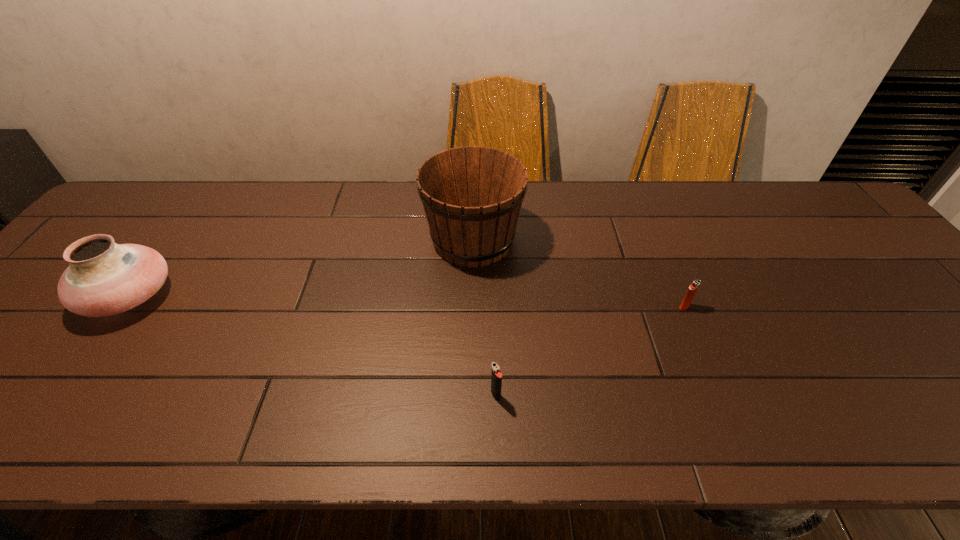
Where is `wine bucket`? The image size is (960, 540). wine bucket is located at coordinates (472, 196).

Locate an element on the screen. This screenshot has width=960, height=540. the leftmost object is located at coordinates (104, 278).

Identify the location of pottery. (104, 278).

Where is `the nearest object`? The image size is (960, 540). the nearest object is located at coordinates (496, 376).

The image size is (960, 540). In order to click on the nearer igniter in this screenshot , I will do `click(496, 376)`.

Image resolution: width=960 pixels, height=540 pixels. I want to click on the right igniter, so coord(694,286).

I want to click on the rightmost object, so [x=694, y=286].

I want to click on free space located on the left of the wine bucket, so click(324, 240).

Locate an element on the screen. vacant space situated on the right of the pottery is located at coordinates (314, 296).

Where is `free region located on the back of the nearer igniter`? The height and width of the screenshot is (540, 960). free region located on the back of the nearer igniter is located at coordinates (492, 292).